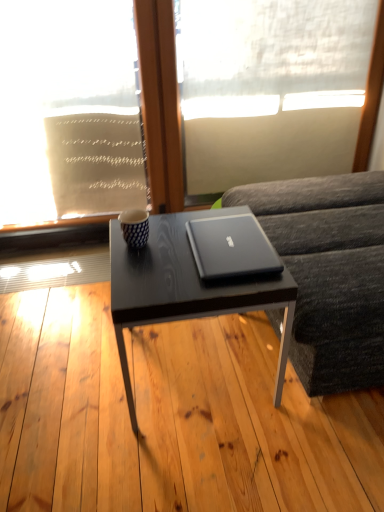
This screenshot has width=384, height=512. In order to click on free area in between blue and white textured mug at center and satin black laptop at center in this screenshot , I will do `click(170, 250)`.